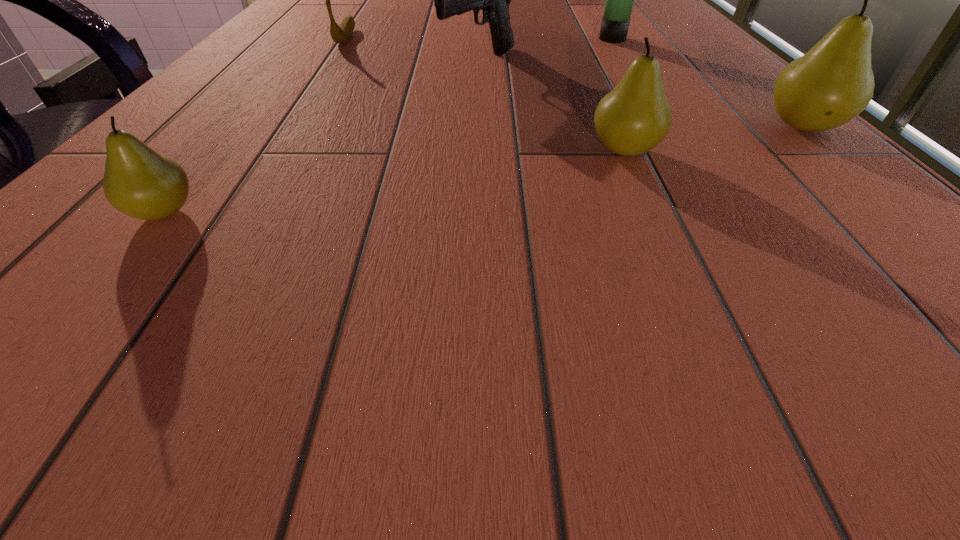
At what (x,y) coordinates should I click in order to perform the action: click on empty space that is in between the gun and the tallest object. Please return your answer as a coordinate pair (x, y). This screenshot has width=960, height=540. Looking at the image, I should click on (546, 51).

The height and width of the screenshot is (540, 960). I want to click on vacant region between the fourth object from right to left and the second object from left to right, so click(x=413, y=51).

This screenshot has height=540, width=960. I want to click on free space between the leftmost pear and the second tallest object, so click(x=483, y=170).

At what (x,y) coordinates should I click in order to perform the action: click on free space between the nearest pear and the gun. Please return your answer as a coordinate pair (x, y). The height and width of the screenshot is (540, 960). Looking at the image, I should click on (322, 138).

Locate an element on the screen. unoccupied area between the second tallest object and the banana is located at coordinates (574, 83).

What are the coordinates of `empty space between the nearest object and the thermos bottle` in the screenshot? It's located at (389, 126).

You are a GUI agent. You are given a task and a screenshot of the screen. Output one action in this format:
    pyautogui.click(x=<x>, y=<y>)
    Task: Click on the free point between the nearest pear and the tallest pear
    
    Given the screenshot: What is the action you would take?
    pyautogui.click(x=483, y=170)

Identify which object is the fourth nearest to the fourth object from left to right. Please provide its 2D coordinates. Your answer should be formatted as a tuple, i.e. [(x, y)], where the tuple contains the x and y coordinates of a point satisfying the conditions above.

[(138, 181)]

Where is `the second closest object to the tallest object`? the second closest object to the tallest object is located at coordinates (831, 84).

Select which pear appears as the second closest to the second object from right to left. Please provide its 2D coordinates. Your answer should be formatted as a tuple, i.e. [(x, y)], where the tuple contains the x and y coordinates of a point satisfying the conditions above.

[(632, 119)]